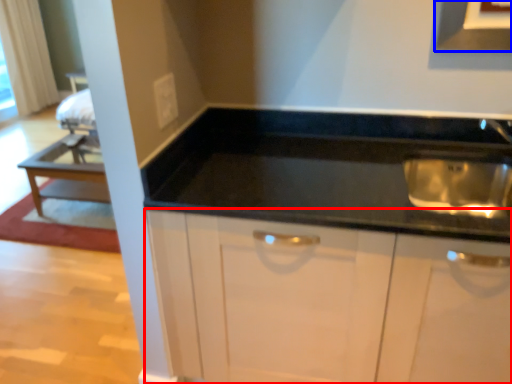
Question: Among these objects, which one is farthest to the camera, cabinetry (highlighted by a red box) or exhaust hood (highlighted by a blue box)?

Choices:
 (A) cabinetry
 (B) exhaust hood

Answer: (B)